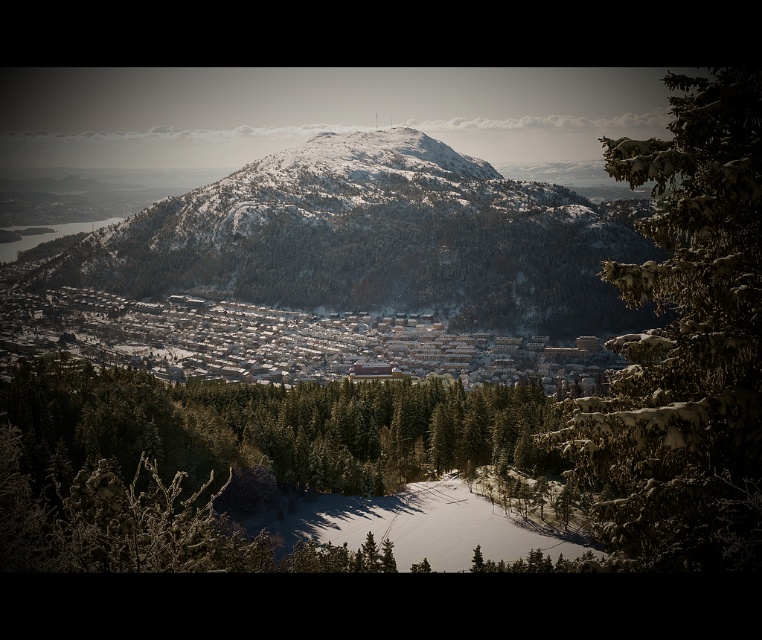
Question: Is green textured pine tree at lower center above white snow-covered houses at center?

Choices:
 (A) no
 (B) yes

Answer: (A)

Question: Among these objects, which one is nearest to the camera?

Choices:
 (A) white snow ski slope at center
 (B) white snow-covered houses at center
 (C) green textured pine tree at lower center

Answer: (C)

Question: Observing the image, what is the correct spatial positioning of snow-covered mountain at center in reference to white snow-covered houses at center?

Choices:
 (A) right
 (B) left

Answer: (A)

Question: Which object is positioned closest to the snow-covered mountain at center?

Choices:
 (A) white snow-covered houses at center
 (B) green textured pine tree at right

Answer: (A)

Question: Based on their relative distances, which object is nearer to the green textured pine tree at right?

Choices:
 (A) snow-covered mountain at center
 (B) white snow-covered houses at center

Answer: (B)

Question: Is white snow-covered houses at center below white snow ski slope at center?

Choices:
 (A) yes
 (B) no

Answer: (B)